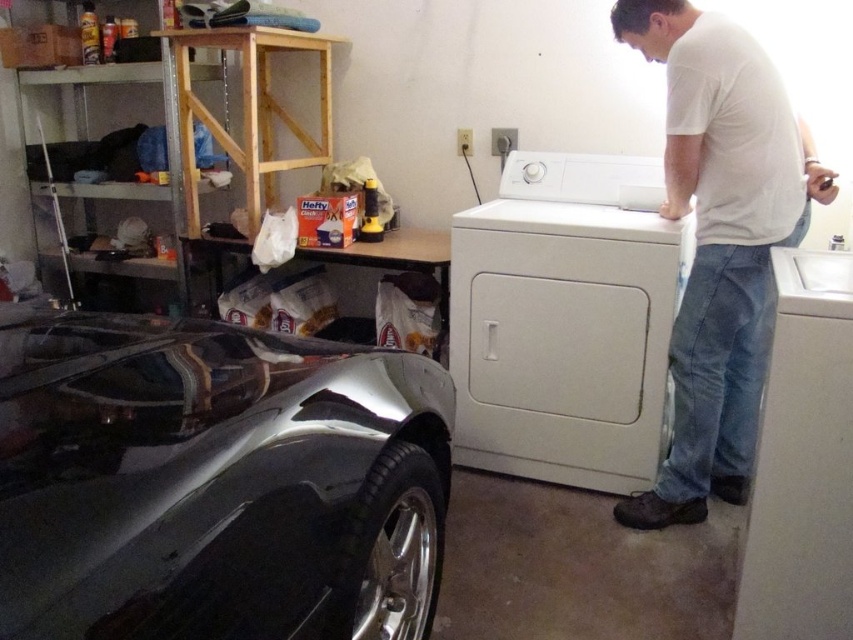
Question: Which of these objects is positioned farthest from the white matte washing machine at center?

Choices:
 (A) glossy metallic car at lower left
 (B) white cotton shirt at upper right

Answer: (A)

Question: Estimate the real-world distances between objects in this image. Which object is closer to the white cotton shirt at upper right?

Choices:
 (A) glossy metallic car at lower left
 (B) white matte washing machine at center

Answer: (B)

Question: Is glossy metallic car at lower left closer to camera compared to white matte washing machine at center?

Choices:
 (A) no
 (B) yes

Answer: (B)

Question: Which point is closer to the camera?

Choices:
 (A) [703, 45]
 (B) [543, 401]
 (C) [355, 634]

Answer: (C)

Question: Is glossy metallic car at lower left wider than white cotton shirt at upper right?

Choices:
 (A) no
 (B) yes

Answer: (B)

Question: Does glossy metallic car at lower left have a larger size compared to white cotton shirt at upper right?

Choices:
 (A) no
 (B) yes

Answer: (B)